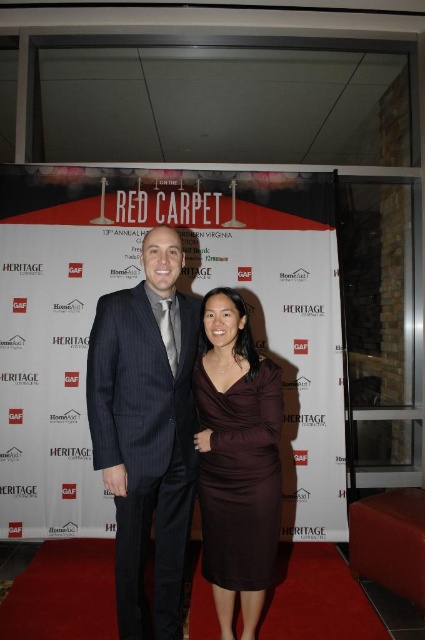
Question: Can you confirm if dark blue pinstripe suit at center is positioned above burgundy satin dress at center?

Choices:
 (A) yes
 (B) no

Answer: (A)

Question: Is dark blue pinstripe suit at center below burgundy satin dress at center?

Choices:
 (A) yes
 (B) no

Answer: (B)

Question: Which point is closer to the camera?

Choices:
 (A) burgundy satin dress at center
 (B) dark blue pinstripe suit at center

Answer: (B)

Question: Which object appears closest to the camera in this image?

Choices:
 (A) dark blue pinstripe suit at center
 (B) burgundy satin dress at center

Answer: (A)

Question: Is dark blue pinstripe suit at center wider than burgundy satin dress at center?

Choices:
 (A) yes
 (B) no

Answer: (A)